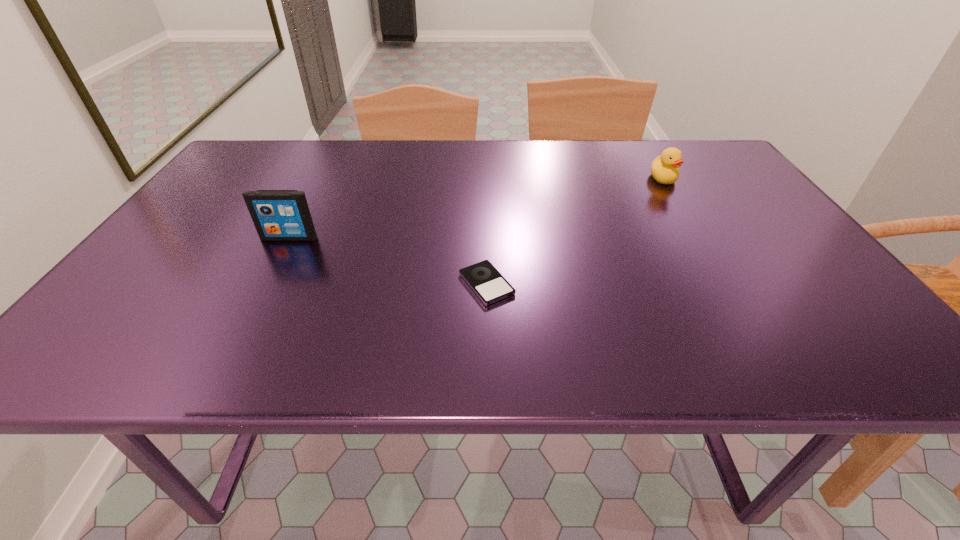
The image size is (960, 540). In order to click on the leftmost object in this screenshot , I will do `click(278, 215)`.

At what (x,y) coordinates should I click in order to perform the action: click on the second nearest object. Please return your answer as a coordinate pair (x, y). Looking at the image, I should click on (278, 215).

Identify the location of duck. The image size is (960, 540). (664, 168).

Locate an element on the screen. The height and width of the screenshot is (540, 960). the farthest object is located at coordinates (664, 168).

This screenshot has width=960, height=540. Identify the location of the shortest object. (484, 279).

Where is `the right iPod`? This screenshot has height=540, width=960. the right iPod is located at coordinates (484, 279).

Where is `free space located on the front screen of the farther iPod`? Image resolution: width=960 pixels, height=540 pixels. free space located on the front screen of the farther iPod is located at coordinates (266, 282).

Locate an element on the screen. vacant space located 0.390m at the beak of the duck is located at coordinates (730, 287).

The width and height of the screenshot is (960, 540). I want to click on free space located 0.240m on the right of the shorter iPod, so click(x=632, y=284).

Identify the location of object located in the far edge section of the desktop. (664, 168).